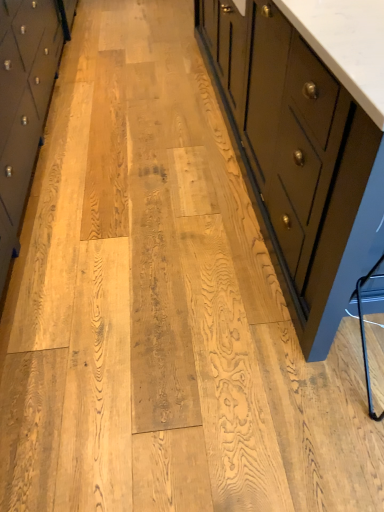
Where is `matte black cabinet at right, which is the second chest of drawers in left-to-right order`? Image resolution: width=384 pixels, height=512 pixels. matte black cabinet at right, which is the second chest of drawers in left-to-right order is located at coordinates point(300,158).

Measure the distance between matte black cabinet at right, which is the second chest of drawers in left-to-right order, and camera.

matte black cabinet at right, which is the second chest of drawers in left-to-right order, is 33.43 inches from camera.

The image size is (384, 512). Describe the element at coordinates (300, 158) in the screenshot. I see `matte black cabinet at right, which is the second chest of drawers in left-to-right order` at that location.

The image size is (384, 512). What do you see at coordinates (24, 106) in the screenshot?
I see `matte black cabinet at left, the first chest of drawers in the left-to-right sequence` at bounding box center [24, 106].

Find the location of a particular element. Image resolution: width=384 pixels, height=512 pixels. matte black cabinet at left, acting as the 2th chest of drawers starting from the right is located at coordinates (24, 106).

Where is `matte black cabinet at right, the first chest of drawers when ordered from right to left`? This screenshot has height=512, width=384. matte black cabinet at right, the first chest of drawers when ordered from right to left is located at coordinates (300, 158).

Considering the positions of objects matte black cabinet at left, the first chest of drawers in the left-to-right sequence, and matte black cabinet at right, which is the second chest of drawers in left-to-right order, in the image provided, who is more to the left, matte black cabinet at left, the first chest of drawers in the left-to-right sequence, or matte black cabinet at right, which is the second chest of drawers in left-to-right order,?

matte black cabinet at left, the first chest of drawers in the left-to-right sequence, is more to the left.

Consider the image. Which is in front, matte black cabinet at left, acting as the 2th chest of drawers starting from the right, or matte black cabinet at right, the first chest of drawers when ordered from right to left?

matte black cabinet at right, the first chest of drawers when ordered from right to left, is in front.

Which is farther, (x=41, y=129) or (x=321, y=228)?

The point (x=41, y=129) is behind.

From the image's perspective, who appears lower, matte black cabinet at left, the first chest of drawers in the left-to-right sequence, or matte black cabinet at right, the first chest of drawers when ordered from right to left?

matte black cabinet at left, the first chest of drawers in the left-to-right sequence, appears lower in the image.

From a real-world perspective, is matte black cabinet at left, the first chest of drawers in the left-to-right sequence, positioned above or below matte black cabinet at right, which is the second chest of drawers in left-to-right order?

matte black cabinet at left, the first chest of drawers in the left-to-right sequence, is situated lower than matte black cabinet at right, which is the second chest of drawers in left-to-right order, in the real world.

Between matte black cabinet at left, the first chest of drawers in the left-to-right sequence, and matte black cabinet at right, the first chest of drawers when ordered from right to left, which one has larger width?

Wider between the two is matte black cabinet at right, the first chest of drawers when ordered from right to left.

Is matte black cabinet at left, acting as the 2th chest of drawers starting from the right, taller than matte black cabinet at right, the first chest of drawers when ordered from right to left?

No, matte black cabinet at left, acting as the 2th chest of drawers starting from the right, is not taller than matte black cabinet at right, the first chest of drawers when ordered from right to left.

Looking at the image, does matte black cabinet at left, the first chest of drawers in the left-to-right sequence, seem bigger or smaller compared to matte black cabinet at right, which is the second chest of drawers in left-to-right order?

Considering their sizes, matte black cabinet at left, the first chest of drawers in the left-to-right sequence, takes up less space than matte black cabinet at right, which is the second chest of drawers in left-to-right order.

In the scene shown: Is matte black cabinet at left, acting as the 2th chest of drawers starting from the right, spatially inside matte black cabinet at right, which is the second chest of drawers in left-to-right order, or outside of it?

matte black cabinet at left, acting as the 2th chest of drawers starting from the right, is outside matte black cabinet at right, which is the second chest of drawers in left-to-right order.

Is matte black cabinet at left, acting as the 2th chest of drawers starting from the right, positioned far away from matte black cabinet at right, the first chest of drawers when ordered from right to left?

That's right, there is a large distance between matte black cabinet at left, acting as the 2th chest of drawers starting from the right, and matte black cabinet at right, the first chest of drawers when ordered from right to left.

Is matte black cabinet at left, acting as the 2th chest of drawers starting from the right, oriented away from matte black cabinet at right, the first chest of drawers when ordered from right to left?

Yes, matte black cabinet at right, the first chest of drawers when ordered from right to left, is at the back of matte black cabinet at left, acting as the 2th chest of drawers starting from the right.

This screenshot has height=512, width=384. In order to click on chest of drawers below the matte black cabinet at right, which is the second chest of drawers in left-to-right order (from the image's perspective) in this screenshot , I will do `click(24, 106)`.

Can you confirm if matte black cabinet at right, which is the second chest of drawers in left-to-right order, is positioned to the left of matte black cabinet at left, the first chest of drawers in the left-to-right sequence?

Incorrect, matte black cabinet at right, which is the second chest of drawers in left-to-right order, is not on the left side of matte black cabinet at left, the first chest of drawers in the left-to-right sequence.

Is the depth of matte black cabinet at right, which is the second chest of drawers in left-to-right order, less than that of matte black cabinet at left, the first chest of drawers in the left-to-right sequence?

Yes, matte black cabinet at right, which is the second chest of drawers in left-to-right order, is in front of matte black cabinet at left, the first chest of drawers in the left-to-right sequence.

Is point (338, 239) closer to camera compared to point (38, 2)?

That is True.

From the image's perspective, is matte black cabinet at right, which is the second chest of drawers in left-to-right order, beneath matte black cabinet at left, acting as the 2th chest of drawers starting from the right?

No, from the image's perspective, matte black cabinet at right, which is the second chest of drawers in left-to-right order, is not beneath matte black cabinet at left, acting as the 2th chest of drawers starting from the right.

From the picture: From a real-world perspective, between matte black cabinet at right, the first chest of drawers when ordered from right to left, and matte black cabinet at left, the first chest of drawers in the left-to-right sequence, who is vertically lower?

matte black cabinet at left, the first chest of drawers in the left-to-right sequence.

Between matte black cabinet at right, which is the second chest of drawers in left-to-right order, and matte black cabinet at left, acting as the 2th chest of drawers starting from the right, which one has larger width?

Wider between the two is matte black cabinet at right, which is the second chest of drawers in left-to-right order.

Considering the sizes of matte black cabinet at right, the first chest of drawers when ordered from right to left, and matte black cabinet at left, acting as the 2th chest of drawers starting from the right, in the image, is matte black cabinet at right, the first chest of drawers when ordered from right to left, taller or shorter than matte black cabinet at left, acting as the 2th chest of drawers starting from the right,?

Considering their sizes, matte black cabinet at right, the first chest of drawers when ordered from right to left, has more height than matte black cabinet at left, acting as the 2th chest of drawers starting from the right.

Can you confirm if matte black cabinet at right, which is the second chest of drawers in left-to-right order, is bigger than matte black cabinet at left, acting as the 2th chest of drawers starting from the right?

Correct, matte black cabinet at right, which is the second chest of drawers in left-to-right order, is larger in size than matte black cabinet at left, acting as the 2th chest of drawers starting from the right.

Would you say matte black cabinet at left, acting as the 2th chest of drawers starting from the right, is part of matte black cabinet at right, the first chest of drawers when ordered from right to left,'s contents?

Definitely not — matte black cabinet at left, acting as the 2th chest of drawers starting from the right, is not inside matte black cabinet at right, the first chest of drawers when ordered from right to left.

Is matte black cabinet at right, which is the second chest of drawers in left-to-right order, next to matte black cabinet at left, the first chest of drawers in the left-to-right sequence, and touching it?

matte black cabinet at right, which is the second chest of drawers in left-to-right order, and matte black cabinet at left, the first chest of drawers in the left-to-right sequence, are clearly separated.

Is matte black cabinet at right, the first chest of drawers when ordered from right to left, looking in the opposite direction of matte black cabinet at left, the first chest of drawers in the left-to-right sequence?

Yes, matte black cabinet at right, the first chest of drawers when ordered from right to left, is positioned with its back facing matte black cabinet at left, the first chest of drawers in the left-to-right sequence.

Can you tell me how much matte black cabinet at right, the first chest of drawers when ordered from right to left, and matte black cabinet at left, the first chest of drawers in the left-to-right sequence, differ in facing direction?

0.162 degrees separate the facing orientations of matte black cabinet at right, the first chest of drawers when ordered from right to left, and matte black cabinet at left, the first chest of drawers in the left-to-right sequence.

In the scene shown: How much distance is there between matte black cabinet at right, the first chest of drawers when ordered from right to left, and matte black cabinet at left, acting as the 2th chest of drawers starting from the right?

The distance of matte black cabinet at right, the first chest of drawers when ordered from right to left, from matte black cabinet at left, acting as the 2th chest of drawers starting from the right, is 3.70 feet.

You are a GUI agent. You are given a task and a screenshot of the screen. Output one action in this format:
    pyautogui.click(x=<x>, y=<y>)
    Task: Click on the chest of drawers below the matte black cabinet at right, the first chest of drawers when ordered from right to left (from a real-world perspective)
    This screenshot has width=384, height=512.
    Given the screenshot: What is the action you would take?
    pyautogui.click(x=24, y=106)

Find the location of `the chest of drawers located in front of the matte black cabinet at left, the first chest of drawers in the left-to-right sequence`. the chest of drawers located in front of the matte black cabinet at left, the first chest of drawers in the left-to-right sequence is located at coordinates (300, 158).

Where is `chest of drawers on the left of matte black cabinet at right, which is the second chest of drawers in left-to-right order`? The image size is (384, 512). chest of drawers on the left of matte black cabinet at right, which is the second chest of drawers in left-to-right order is located at coordinates (24, 106).